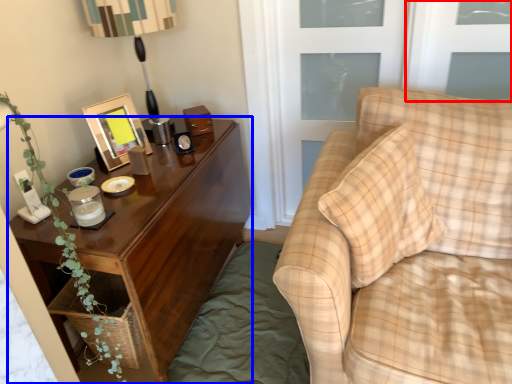
Question: Among these objects, which one is farthest to the camera, window (highlighted by a red box) or nightstand (highlighted by a blue box)?

Choices:
 (A) window
 (B) nightstand

Answer: (A)